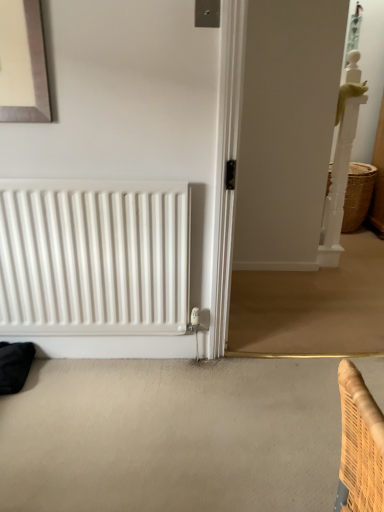
The width and height of the screenshot is (384, 512). What do you see at coordinates (286, 130) in the screenshot?
I see `white glossy screen door at right` at bounding box center [286, 130].

Image resolution: width=384 pixels, height=512 pixels. What do you see at coordinates (358, 195) in the screenshot?
I see `woven straw basket at right` at bounding box center [358, 195].

The height and width of the screenshot is (512, 384). Find the location of `white matte radiator at lower left`. white matte radiator at lower left is located at coordinates tap(93, 258).

Looking at this image, from a real-world perspective, is white matte radiator at lower left positioned above or below white glossy screen door at right?

→ white matte radiator at lower left is situated lower than white glossy screen door at right in the real world.

Image resolution: width=384 pixels, height=512 pixels. In order to click on screen door above the white matte radiator at lower left (from a real-world perspective) in this screenshot , I will do `click(286, 130)`.

Could you tell me if white matte radiator at lower left is turned towards white glossy screen door at right?

No, white matte radiator at lower left is not aimed at white glossy screen door at right.

Which is less distant, (361, 180) or (51, 298)?

Clearly, point (361, 180) is more distant from the camera than point (51, 298).

Is woven straw basket at right in contact with white matte radiator at lower left?

No, woven straw basket at right is not touching white matte radiator at lower left.

From a real-world perspective, relative to white matte radiator at lower left, is woven straw basket at right vertically above or below?

woven straw basket at right is situated lower than white matte radiator at lower left in the real world.

Do you think white glossy screen door at right is within woven straw basket at right, or outside of it?

The correct answer is: outside.

From a real-world perspective, is white glossy screen door at right physically below woven straw basket at right?

Actually, white glossy screen door at right is physically above woven straw basket at right in the real world.

Can you confirm if white glossy screen door at right is thinner than woven straw basket at right?

Yes.

Can you see woven straw basket at right touching white glossy screen door at right?

No, woven straw basket at right is not next to white glossy screen door at right.

Which is closer to the camera, [371,175] or [270,127]?

The point [270,127] is more forward.

Is woven straw basket at right situated inside white glossy screen door at right or outside?

The correct answer is: outside.

Which of these two, woven straw basket at right or white glossy screen door at right, is smaller?

woven straw basket at right is smaller.

From the picture: Does white glossy screen door at right lie in front of white matte radiator at lower left?

Yes, white glossy screen door at right is in front of white matte radiator at lower left.

Can you confirm if white glossy screen door at right is smaller than white matte radiator at lower left?

Incorrect, white glossy screen door at right is not smaller in size than white matte radiator at lower left.

Is white glossy screen door at right positioned with its back to white matte radiator at lower left?

No.

Is white glossy screen door at right to the right of white matte radiator at lower left from the viewer's perspective?

Indeed, white glossy screen door at right is positioned on the right side of white matte radiator at lower left.

From their relative heights in the image, would you say white matte radiator at lower left is taller or shorter than woven straw basket at right?

Clearly, white matte radiator at lower left is taller compared to woven straw basket at right.

How different are the orientations of white matte radiator at lower left and woven straw basket at right in degrees?

0.108 degrees.

From a real-world perspective, which is physically above, white matte radiator at lower left or woven straw basket at right?

white matte radiator at lower left is physically above.

From the picture: How distant is white matte radiator at lower left from woven straw basket at right?

A distance of 7.31 feet exists between white matte radiator at lower left and woven straw basket at right.

You are a GUI agent. You are given a task and a screenshot of the screen. Output one action in this format:
    pyautogui.click(x=<x>, y=<y>)
    Task: Click on the screen door above the white matte radiator at lower left (from a real-world perspective)
    
    Given the screenshot: What is the action you would take?
    pyautogui.click(x=286, y=130)

This screenshot has width=384, height=512. I want to click on radiator below the woven straw basket at right (from the image's perspective), so click(93, 258).

Looking at the image, which one is located further to white glossy screen door at right, white matte radiator at lower left or woven straw basket at right?

white matte radiator at lower left is further to white glossy screen door at right.

Based on their spatial positions, is white glossy screen door at right or white matte radiator at lower left closer to woven straw basket at right?

white glossy screen door at right lies closer to woven straw basket at right than the other object.

When comparing their distances from white matte radiator at lower left, does white glossy screen door at right or woven straw basket at right seem further?

woven straw basket at right.

Looking at the image, which one is located closer to white glossy screen door at right, woven straw basket at right or white matte radiator at lower left?

woven straw basket at right is positioned closer to the anchor white glossy screen door at right.

Consider the image. Looking at the image, which one is located closer to white matte radiator at lower left, woven straw basket at right or white glossy screen door at right?

white glossy screen door at right lies closer to white matte radiator at lower left than the other object.

Looking at the image, which one is located further to woven straw basket at right, white matte radiator at lower left or white glossy screen door at right?

Among the two, white matte radiator at lower left is located further to woven straw basket at right.

The width and height of the screenshot is (384, 512). I want to click on radiator between white glossy screen door at right and woven straw basket at right from front to back, so click(x=93, y=258).